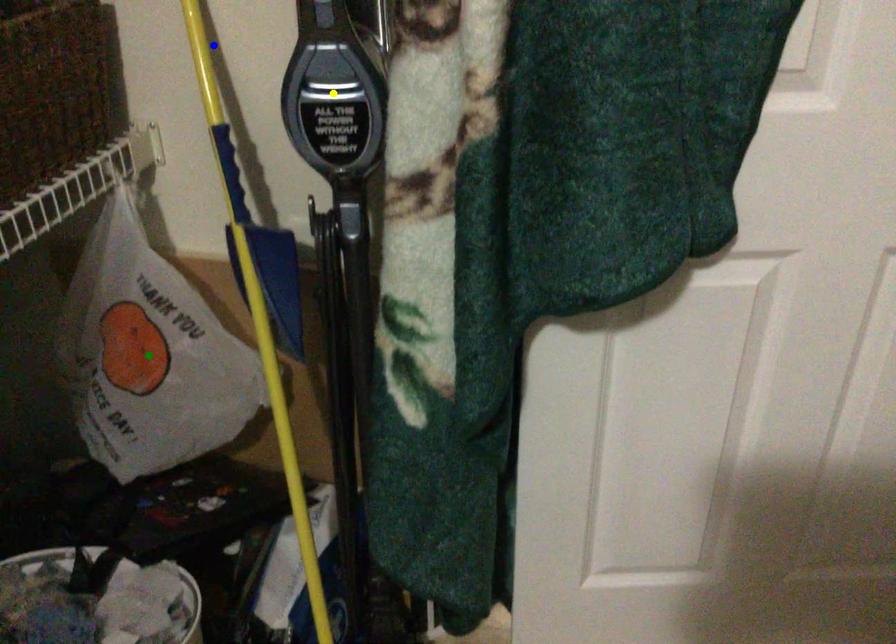
Order these from nearest to farthest:
yellow point
green point
blue point

yellow point
blue point
green point